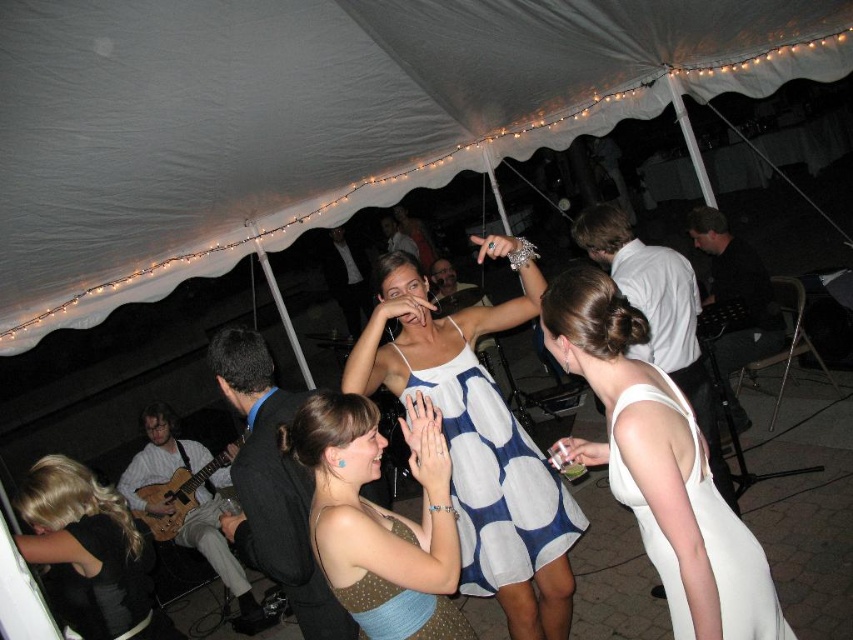
You are a photographer at the event and want to capture a photo of the polka dot dress at center without the white fabric canopy at upper center blocking the view. Is the canopy wider than the dress?

The white fabric canopy at upper center might be wider than polka dot dress at center, so there is a possibility that the canopy could block the view depending on the angle and positioning.

You are standing inside the tent and want to locate two specific points marked in the image. Which of the two points, point 1 at coordinates point (421,589) or point 2 at coordinates point (32,516), is closer to you?

Point 1 at coordinates point (421,589) is closer to the viewer than point 2 at coordinates point (32,516).

You are organizing a photo shoot and need to place a camera stand between the polka dot dress at center and the black leather jacket at lower left. Which object should the stand be closer to if you want it to be near the smaller one?

The polka dot dress at center is smaller than the black leather jacket at lower left, so the camera stand should be closer to the polka dot dress at center.